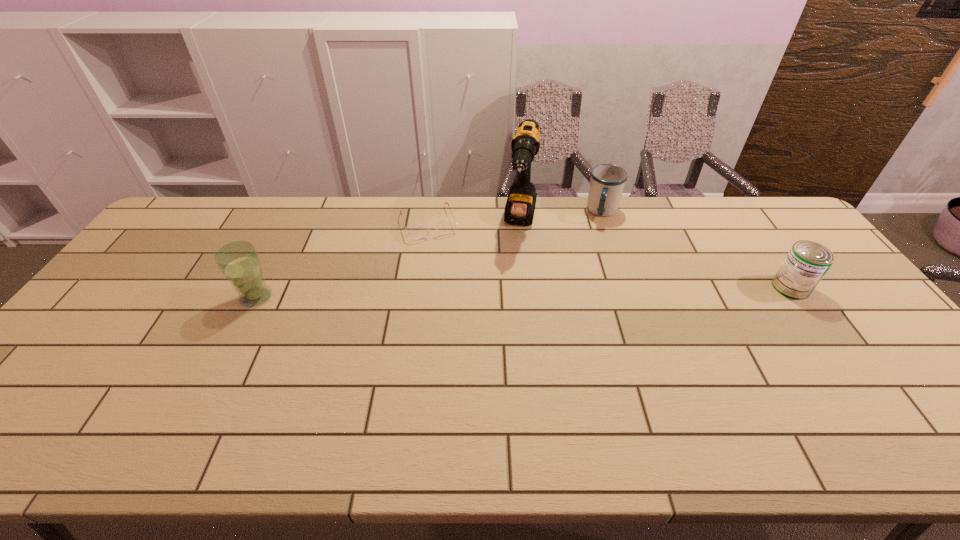
You are a GUI agent. You are given a task and a screenshot of the screen. Output one action in this format:
    pyautogui.click(x=<x>, y=<y>)
    Task: Click on the free space between the rightmost object and the glass
    
    Given the screenshot: What is the action you would take?
    pos(523,292)

Image resolution: width=960 pixels, height=540 pixels. I want to click on vacant space that is in between the can and the fourth object from right to left, so click(x=610, y=255).

At what (x,y) coordinates should I click in order to perform the action: click on free point between the spectacles and the can. Please return your answer as a coordinate pair (x, y). The image size is (960, 540). Looking at the image, I should click on (610, 255).

At what (x,y) coordinates should I click in order to perform the action: click on free space between the glass and the rightmost object. Please return your answer as a coordinate pair (x, y). The image size is (960, 540). Looking at the image, I should click on (523, 292).

The height and width of the screenshot is (540, 960). Find the location of `empty space between the can and the third object from left to right`. empty space between the can and the third object from left to right is located at coordinates (656, 254).

Image resolution: width=960 pixels, height=540 pixels. I want to click on free space between the tallest object and the mug, so click(562, 216).

At what (x,y) coordinates should I click in order to perform the action: click on object that is the fourth closest one to the drill. Please return your answer as a coordinate pair (x, y). This screenshot has width=960, height=540. Looking at the image, I should click on (239, 262).

Locate which object ranks third in proximity to the mug. Please provide its 2D coordinates. Your answer should be formatted as a tuple, i.e. [(x, y)], where the tuple contains the x and y coordinates of a point satisfying the conditions above.

[(446, 226)]

The height and width of the screenshot is (540, 960). I want to click on vacant space that satisfies the following two spatial constraints: 1. on the back side of the drill; 2. on the left side of the leftmost object, so click(295, 221).

Where is `vacant area that satisfies the following two spatial constraints: 1. on the back side of the shortest object; 2. on the left side of the mug`? The width and height of the screenshot is (960, 540). vacant area that satisfies the following two spatial constraints: 1. on the back side of the shortest object; 2. on the left side of the mug is located at coordinates (430, 212).